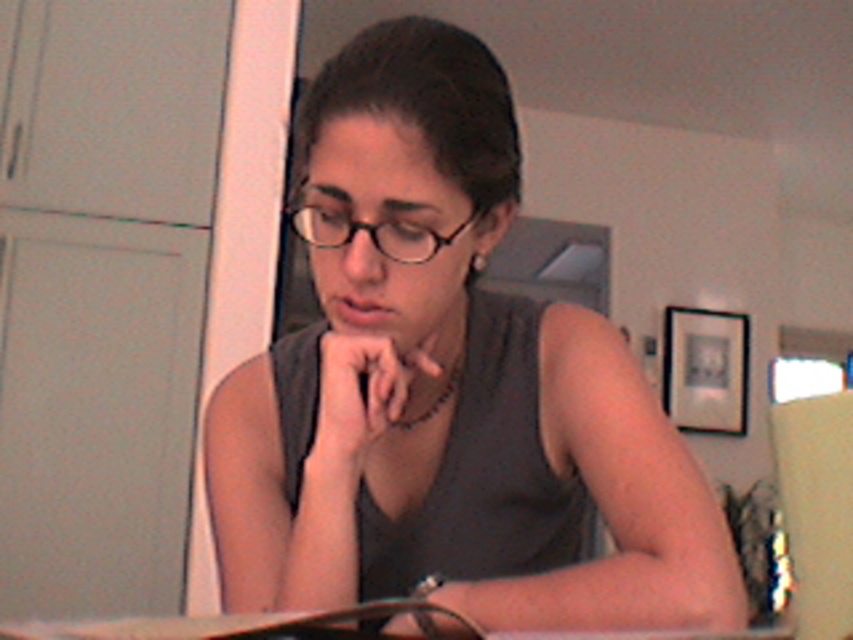
You are a fashion designer observing the person in the scene. You need to determine the placement of the matte gray tank top at center and the black plastic glasses at center for a photo shoot. Which item is located lower on the person?

The matte gray tank top at center is positioned under the black plastic glasses at center, so the tank top is lower than the glasses on the person.

You are a fashion designer analyzing the image of a person in a kitchen. You need to determine which item, the matte gray tank top at center or the black plastic glasses at center, occupies more vertical space in the image. Which one is taller?

The matte gray tank top at center has a greater height compared to the black plastic glasses at center, so the matte gray tank top at center is taller.